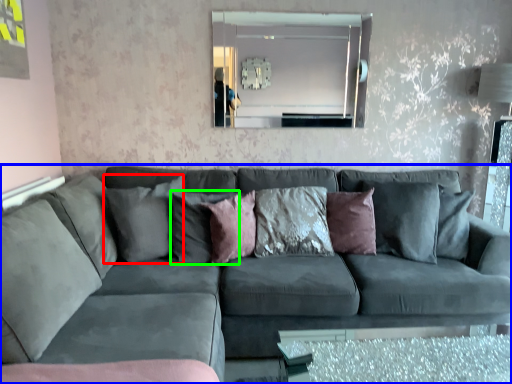
Question: Which is nearer to the pillow (highlighted by a red box)? studio couch (highlighted by a blue box) or pillow (highlighted by a green box).

Choices:
 (A) studio couch
 (B) pillow

Answer: (B)